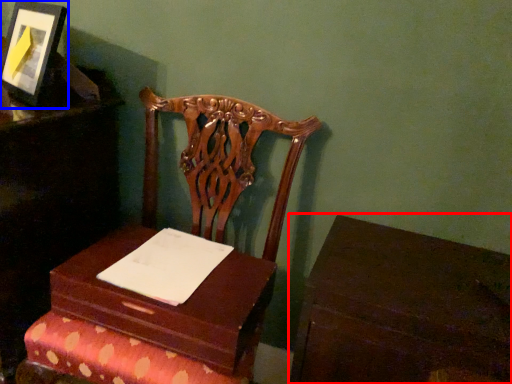
Question: Which object appears farthest to the camera in this image, table (highlighted by a red box) or picture frame (highlighted by a blue box)?

Choices:
 (A) table
 (B) picture frame

Answer: (B)